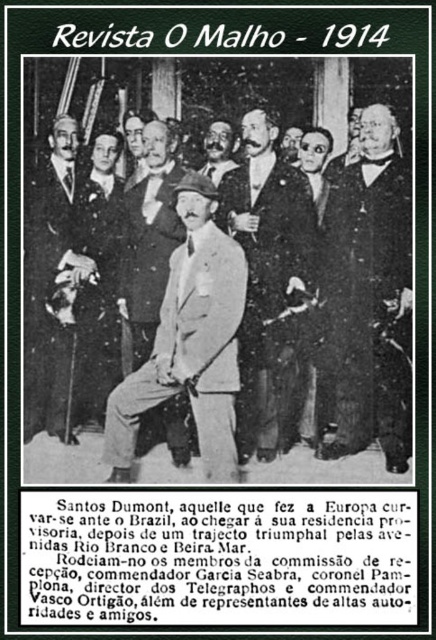
Question: Is dark gray suit at center bigger than light brown leather coat at center?

Choices:
 (A) no
 (B) yes

Answer: (B)

Question: Which object is farther from the camera taking this photo?

Choices:
 (A) light gray suit at center
 (B) dark gray suit at center
 (C) light brown leather coat at center

Answer: (C)

Question: Which of the following is the farthest from the observer?

Choices:
 (A) light gray suit at center
 (B) light brown leather coat at center

Answer: (B)

Question: Which object appears closest to the camera in this image?

Choices:
 (A) dark brown leather jacket at center
 (B) smooth black suit at center
 (C) light brown leather coat at center
 (D) light gray suit at center

Answer: (D)

Question: Can you confirm if light gray suit at center is positioned to the left of light brown leather coat at center?

Choices:
 (A) no
 (B) yes

Answer: (A)

Question: Is light gray suit at center bigger than smooth gray suit at center?

Choices:
 (A) yes
 (B) no

Answer: (A)